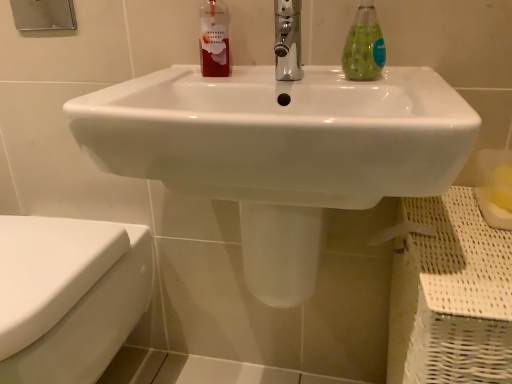
Find the location of a particular element. The image size is (512, 384). vacant space that is to the left of chrome metallic faucet at center is located at coordinates (x=223, y=83).